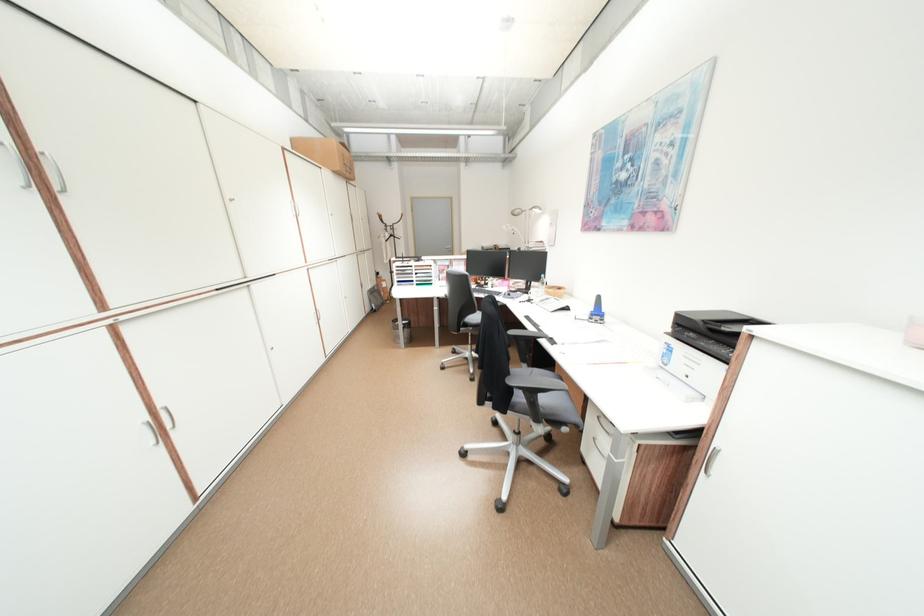
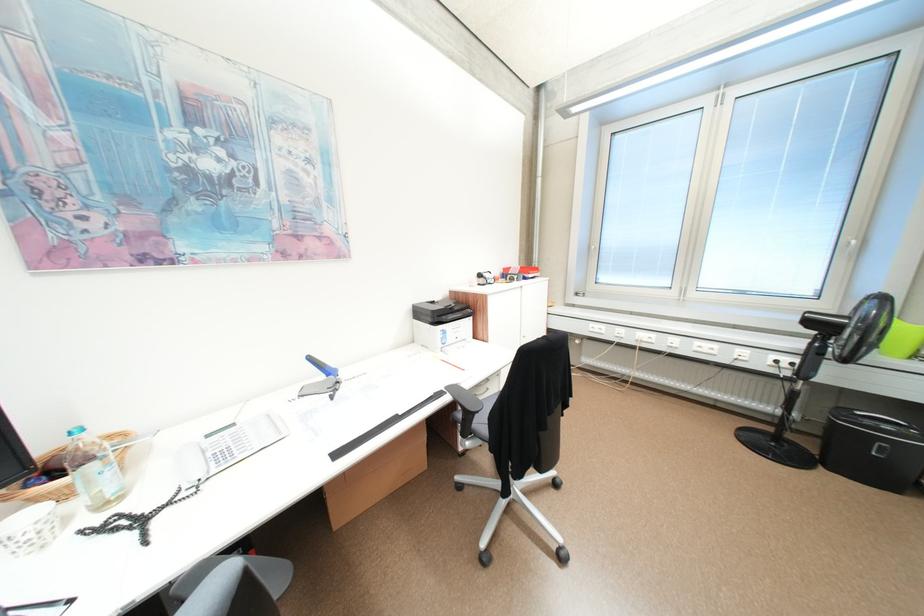
Locate, in the second image, the point that corresponds to [609,298] in the first image.

(320, 359)